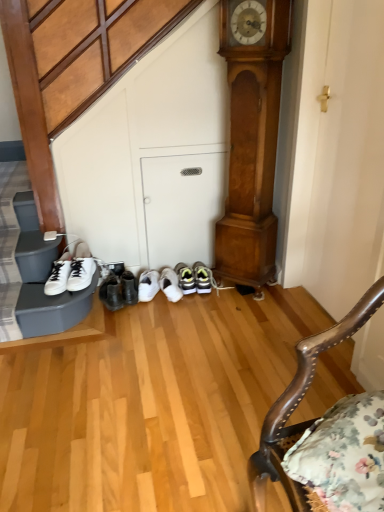
Question: Is white matte sneakers at left taller or shorter than wooden polished chair at lower right?

Choices:
 (A) short
 (B) tall

Answer: (A)

Question: Considering the relative positions of white matte sneakers at left and wooden polished chair at lower right in the image provided, is white matte sneakers at left to the left or to the right of wooden polished chair at lower right?

Choices:
 (A) left
 (B) right

Answer: (A)

Question: Considering the real-world distances, which object is farthest from the wooden polished chair at lower right?

Choices:
 (A) white matte sneakers at left
 (B) polished wood grandfather clock at center

Answer: (A)

Question: Considering the real-world distances, which object is farthest from the white matte sneakers at left?

Choices:
 (A) wooden polished chair at lower right
 (B) polished wood grandfather clock at center

Answer: (A)